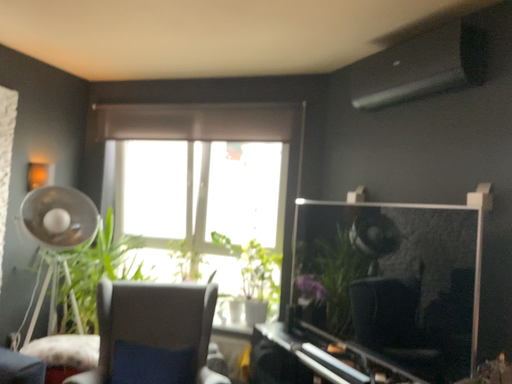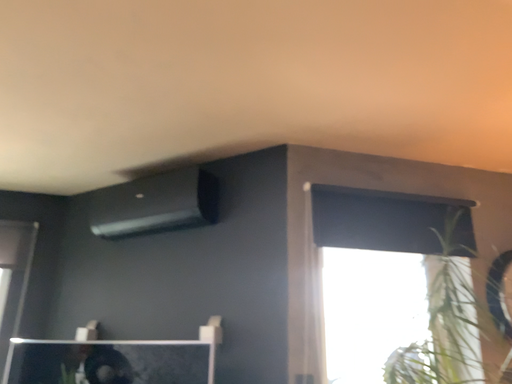
Question: How did the camera likely rotate when shooting the video?

Choices:
 (A) rotated left
 (B) rotated right

Answer: (B)